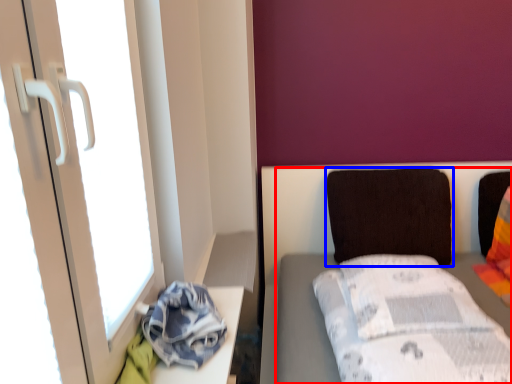
Question: Among these objects, which one is farthest to the camera, furniture (highlighted by a red box) or pillow (highlighted by a blue box)?

Choices:
 (A) furniture
 (B) pillow

Answer: (B)